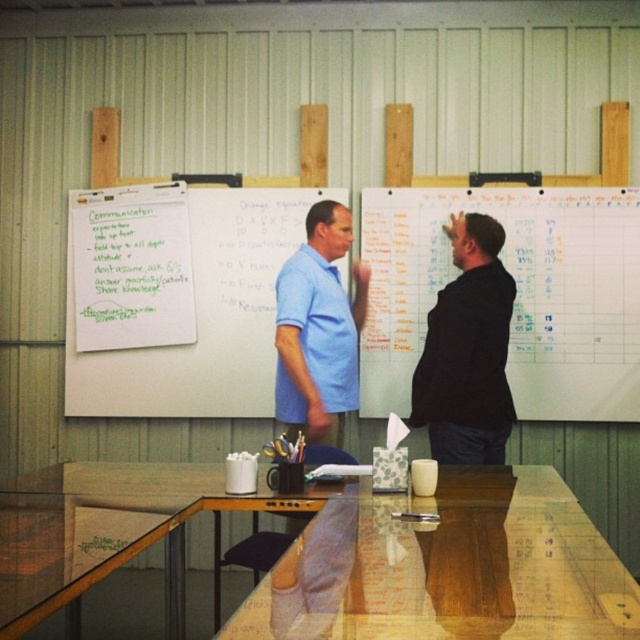
Looking at this image, does transparent glass table at center have a greater height compared to transparent glass table at lower left?

No, transparent glass table at center is not taller than transparent glass table at lower left.

Does transparent glass table at center have a lesser width compared to transparent glass table at lower left?

No.

Between point (390, 602) and point (64, 515), which one is positioned in front?

Point (390, 602) is in front.

Identify the location of transparent glass table at center. (448, 570).

Can you confirm if whiteboard at upper right is shorter than transparent glass table at lower left?

Incorrect, whiteboard at upper right's height does not fall short of transparent glass table at lower left's.

Is point (577, 310) closer to camera compared to point (131, 516)?

No, (577, 310) is behind (131, 516).

You are a GUI agent. You are given a task and a screenshot of the screen. Output one action in this format:
    pyautogui.click(x=<x>, y=<y>)
    Task: Click on the whiteboard at upper right
    This screenshot has height=640, width=640.
    Given the screenshot: What is the action you would take?
    pyautogui.click(x=515, y=296)

Measure the distance from whiteboard at upper right to black matte shirt at center.

whiteboard at upper right and black matte shirt at center are 26.69 inches apart.

At what (x,y) coordinates should I click in order to perform the action: click on whiteboard at upper right. Please return your answer as a coordinate pair (x, y). This screenshot has height=640, width=640. Looking at the image, I should click on pyautogui.click(x=515, y=296).